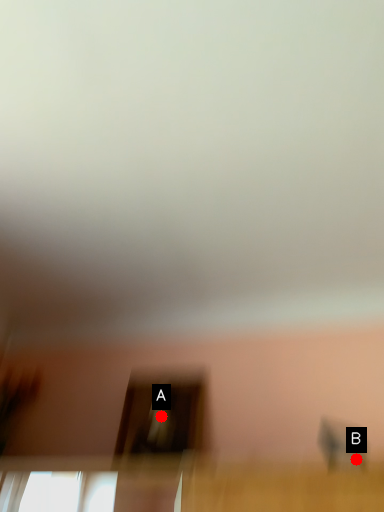
Question: Two points are circled on the image, labeled by A and B beside each circle. Which point is closer to the camera?

Choices:
 (A) A is closer
 (B) B is closer

Answer: (B)